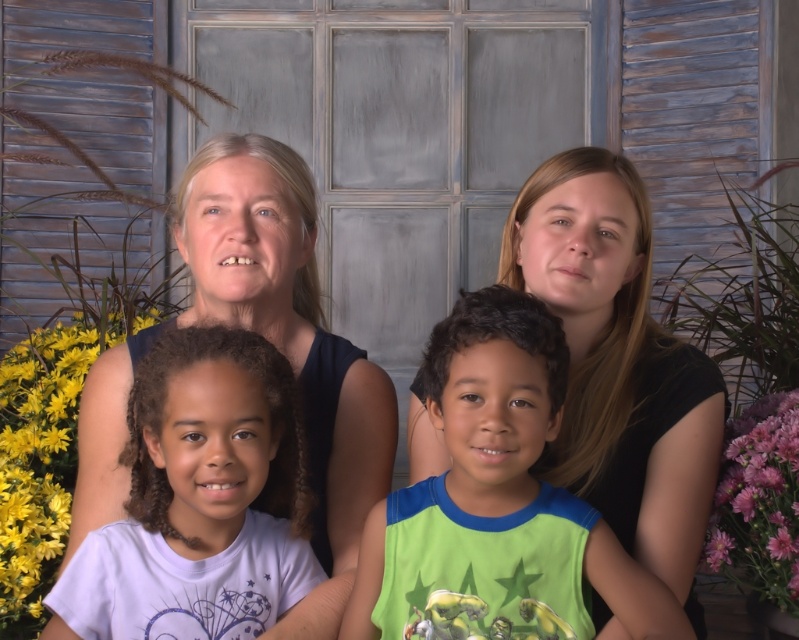
You are standing 1.5 meters away from the point at coordinates point [133,422]. Can you reach it without moving closer?

The distance of point [133,422] from viewer is 1.41 meters, so yes, you can reach it without moving closer since you are currently 1.5 meters away, which is slightly farther than the point.

You are a photographer setting up for a group photo. You notice the white matte shirt at lower left and the purple silky flower at right. Based on their sizes, which object would you need to adjust your camera focus more carefully to ensure clarity?

The white matte shirt at lower left requires more careful focus adjustment because it is larger in width than the purple silky flower at right.